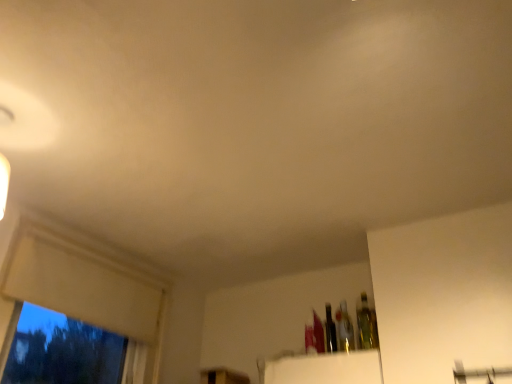
Question: Considering the positions of translucent glass bottle at upper right, the 3th bottle in the left-to-right sequence, and white matte window frame at left in the image, is translucent glass bottle at upper right, the 3th bottle in the left-to-right sequence, wider or thinner than white matte window frame at left?

Choices:
 (A) thin
 (B) wide

Answer: (A)

Question: From a real-world perspective, is translucent glass bottle at upper right, which ranks as the 1th bottle in right-to-left order, above or below white matte window frame at left?

Choices:
 (A) above
 (B) below

Answer: (B)

Question: Which object is positioned closest to the translucent glass bottle at center, which is counted as the second bottle, starting from the left?

Choices:
 (A) translucent glass bottle at upper right, the 3th bottle in the left-to-right sequence
 (B) shiny metallic bottle at upper right, placed as the 3th bottle when sorted from right to left
 (C) white matte window frame at left

Answer: (B)

Question: Estimate the real-world distances between objects in this image. Which object is closer to the shiny metallic bottle at upper right, the first bottle from the left?

Choices:
 (A) translucent glass bottle at upper right, the 3th bottle in the left-to-right sequence
 (B) translucent glass bottle at center, which is counted as the second bottle, starting from the left
 (C) white matte window frame at left

Answer: (B)